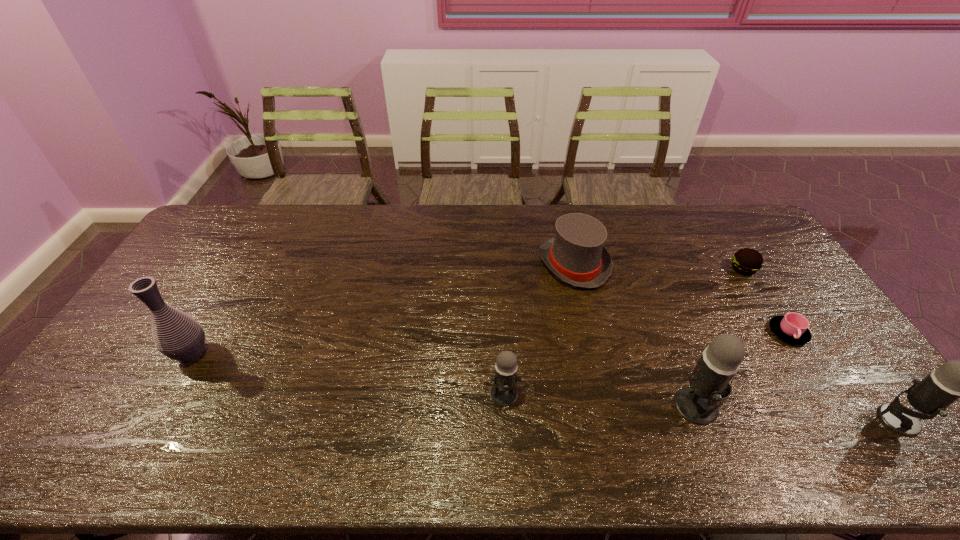
The height and width of the screenshot is (540, 960). Find the location of `vacant region between the dress hat and the tallest microphone`. vacant region between the dress hat and the tallest microphone is located at coordinates (636, 335).

Image resolution: width=960 pixels, height=540 pixels. Find the location of `free area in between the second object from left to right and the leftmost object`. free area in between the second object from left to right and the leftmost object is located at coordinates (348, 374).

This screenshot has width=960, height=540. Identify the location of free space between the second shortest object and the sixth object from right to left. (624, 332).

Where is `free spot between the patty and the third shortest object`? The image size is (960, 540). free spot between the patty and the third shortest object is located at coordinates (659, 267).

At what (x,y) coordinates should I click in order to perform the action: click on free area in between the leftmost object and the fourth object from right to left. Please return your answer as a coordinate pair (x, y). Image resolution: width=960 pixels, height=540 pixels. Looking at the image, I should click on (444, 380).

Identify the location of vacant space in between the shortest object and the patty. (765, 301).

Image resolution: width=960 pixels, height=540 pixels. What are the coordinates of `free spot between the shortest object and the dress hat` in the screenshot? It's located at (681, 299).

At what (x,y) coordinates should I click in order to perform the action: click on free space that is in between the third object from left to right and the vase. Please return your answer as a coordinate pair (x, y). Looking at the image, I should click on (383, 309).

The height and width of the screenshot is (540, 960). Find the location of `free spot between the rightmost microphone and the vase`. free spot between the rightmost microphone and the vase is located at coordinates (544, 387).

Where is `blank region between the dress hat and the cup`? This screenshot has width=960, height=540. blank region between the dress hat and the cup is located at coordinates (681, 299).